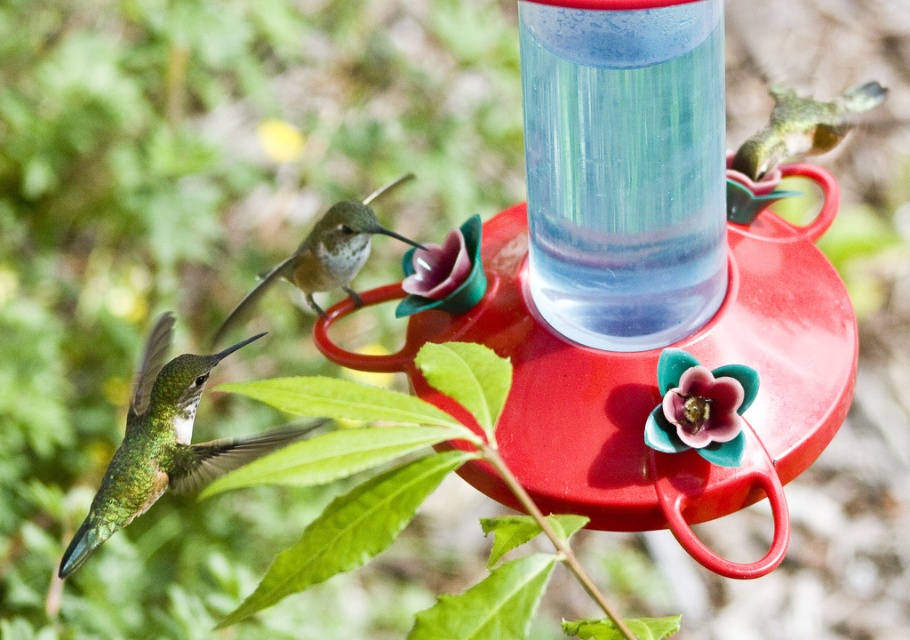
Who is lower down, red plastic bird feeder at center or green iridescent feathers at center?

green iridescent feathers at center

Which is more to the left, red plastic bird feeder at center or green iridescent feathers at center?

green iridescent feathers at center

Is point (403, 362) positioned after point (357, 252)?

That is True.

At what (x,y) coordinates should I click in order to perform the action: click on red plastic bird feeder at center. Please return your answer as a coordinate pair (x, y). Looking at the image, I should click on (641, 284).

How distant is green iridescent feathers at center from pink matte flower at center?

The distance of green iridescent feathers at center from pink matte flower at center is 0.81 inches.

Does green iridescent feathers at center come in front of pink matte flower at center?

Yes, green iridescent feathers at center is closer to the viewer.

Who is more forward, (319, 221) or (413, 259)?

Positioned in front is point (319, 221).

I want to click on green iridescent feathers at center, so click(x=324, y=257).

Describe the element at coordinates (164, 444) in the screenshot. I see `green iridescent hummingbird at left` at that location.

Does green iridescent hummingbird at left have a greater height compared to pink glossy flower at center?

Yes.

Which is behind, point (113, 515) or point (656, 417)?

The point (656, 417) is behind.

I want to click on green iridescent hummingbird at left, so point(164,444).